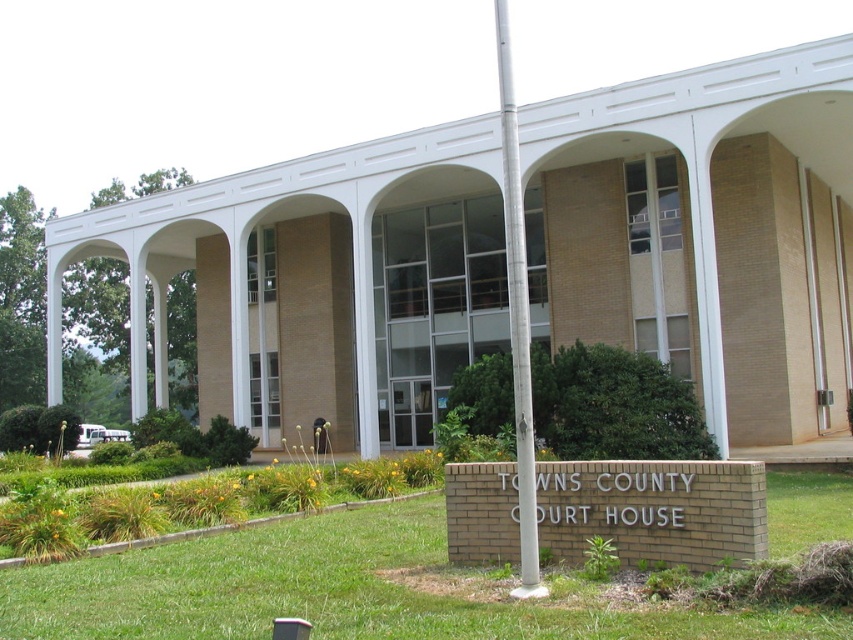
You are standing in front of the Towns County Court House and notice the green grass at lower center and the silver metallic flag pole at center. Which of these two objects is wider?

The green grass at lower center is wider than the silver metallic flag pole at center.

You are standing at the entrance of the Towns County Court House and notice a specific coordinate point marked on the ground. According to the image, what type of terrain is located at the point labeled as point (337, 592)?

The point (337, 592) corresponds to green grass at lower center.